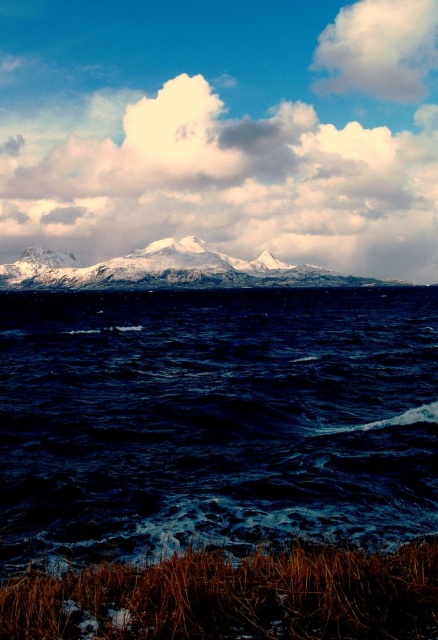
Consider the image. Who is positioned more to the right, dark blue water at center or brown grass at lower center?

From the viewer's perspective, brown grass at lower center appears more on the right side.

Between dark blue water at center and brown grass at lower center, which one is positioned higher?

Positioned higher is dark blue water at center.

Identify the location of dark blue water at center. (215, 419).

Is point (38, 273) more distant than point (395, 52)?

No.

Is snowy rock mountain at upper center taller than white fluffy cloud at upper right?

Incorrect, snowy rock mountain at upper center's height is not larger of white fluffy cloud at upper right's.

Who is more distant from viewer, (52, 252) or (352, 44)?

The point (352, 44) is behind.

Image resolution: width=438 pixels, height=640 pixels. I want to click on snowy rock mountain at upper center, so click(x=169, y=269).

Which is more to the left, dark blue water at center or white fluffy cloud at upper center?

From the viewer's perspective, white fluffy cloud at upper center appears more on the left side.

Does point (255, 424) come closer to viewer compared to point (162, 122)?

That is True.

Image resolution: width=438 pixels, height=640 pixels. I want to click on dark blue water at center, so click(215, 419).